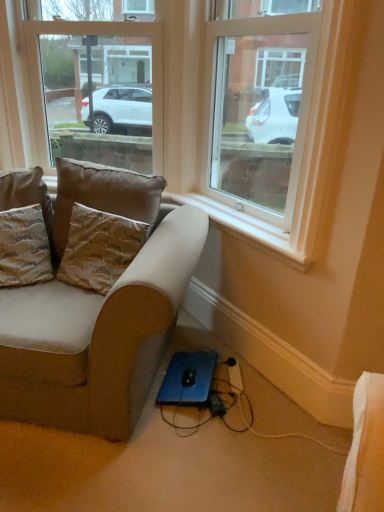
In order to face brown fabric pillow at upper left, positioned as the third pillow in left-to-right order, should I rotate leftwards or rightwards?

To face it directly, rotate left by 11.805 degrees.

Locate an element on the screen. The width and height of the screenshot is (384, 512). clear glass window at upper center, marked as the 1th window in a left-to-right arrangement is located at coordinates (97, 90).

The width and height of the screenshot is (384, 512). Identify the location of white smooth window sill at center. (246, 229).

I want to click on clear glass window at upper center, marked as the 2th window in a left-to-right arrangement, so click(259, 103).

This screenshot has width=384, height=512. Describe the element at coordinates (24, 247) in the screenshot. I see `textured brown pillow at left, the 3th pillow viewed from the right` at that location.

Where is `beige fabric couch at lower left`? beige fabric couch at lower left is located at coordinates (98, 313).

Could you tell me if beige fabric couch at lower left is facing textured brown pillow at left, the first pillow viewed from the left?

No, beige fabric couch at lower left is not aimed at textured brown pillow at left, the first pillow viewed from the left.

In terms of size, does beige fabric couch at lower left appear bigger or smaller than textured brown pillow at left, the first pillow viewed from the left?

Considering their sizes, beige fabric couch at lower left takes up more space than textured brown pillow at left, the first pillow viewed from the left.

From the picture: Between beige fabric couch at lower left and textured brown pillow at left, the first pillow viewed from the left, which one has smaller width?

textured brown pillow at left, the first pillow viewed from the left.

Considering the positions of objects beige fabric couch at lower left and textured brown pillow at left, placed as the 4th pillow when sorted from right to left, in the image provided, who is in front, beige fabric couch at lower left or textured brown pillow at left, placed as the 4th pillow when sorted from right to left,?

beige fabric couch at lower left.

Considering the relative sizes of textured brown pillow at left, which is counted as the 2th pillow, starting from the left, and textured brown pillow at left, the first pillow viewed from the left, in the image provided, is textured brown pillow at left, which is counted as the 2th pillow, starting from the left, wider than textured brown pillow at left, the first pillow viewed from the left,?

No.

Is textured brown pillow at left, which is counted as the 2th pillow, starting from the left, inside or outside of textured brown pillow at left, the first pillow viewed from the left?

textured brown pillow at left, which is counted as the 2th pillow, starting from the left, is contained in textured brown pillow at left, the first pillow viewed from the left.

Is point (21, 232) closer to camera compared to point (16, 170)?

That is True.

Who is taller, textured brown pillow at left, the 3th pillow viewed from the right, or textured brown pillow at left, placed as the 4th pillow when sorted from right to left?

With more height is textured brown pillow at left, placed as the 4th pillow when sorted from right to left.

Would you say textured brown pillow at left, the first pillow viewed from the left, is part of black plastic extension cord at lower center's contents?

No, textured brown pillow at left, the first pillow viewed from the left, is not a part of black plastic extension cord at lower center.

Is black plastic extension cord at lower center wider or thinner than textured brown pillow at left, the first pillow viewed from the left?

Clearly, black plastic extension cord at lower center has less width compared to textured brown pillow at left, the first pillow viewed from the left.

Is black plastic extension cord at lower center bigger or smaller than textured brown pillow at left, the first pillow viewed from the left?

black plastic extension cord at lower center is smaller than textured brown pillow at left, the first pillow viewed from the left.

This screenshot has width=384, height=512. What are the coordinates of `extension cord below the textured brown pillow at left, placed as the 4th pillow when sorted from right to left (from the image's perspective)` in the screenshot? It's located at (234, 376).

Considering the positions of points (300, 258) and (236, 385), is point (300, 258) closer to camera compared to point (236, 385)?

That is True.

Looking at this image, is white smooth window sill at center inside the boundaries of black plastic extension cord at lower center, or outside?

white smooth window sill at center is not inside black plastic extension cord at lower center, it's outside.

Which object is further away from the camera taking this photo, white smooth window sill at center or black plastic extension cord at lower center?

black plastic extension cord at lower center.

From a real-world perspective, which object rests below the other?

black plastic extension cord at lower center.

Is the position of textured brown pillow at left, the first pillow viewed from the left, less distant than that of clear glass window at upper center, marked as the 1th window in a left-to-right arrangement?

Yes, textured brown pillow at left, the first pillow viewed from the left, is closer to the camera.

Is clear glass window at upper center, which ranks as the second window in right-to-left order, located within textured brown pillow at left, placed as the 4th pillow when sorted from right to left?

No.

From the picture: Which is less distant, (47,218) or (121,26)?

Point (47,218) appears to be closer to the viewer than point (121,26).

Is textured brown pillow at left, the first pillow viewed from the left, thinner than clear glass window at upper center, marked as the 1th window in a left-to-right arrangement?

No, textured brown pillow at left, the first pillow viewed from the left, is not thinner than clear glass window at upper center, marked as the 1th window in a left-to-right arrangement.

From a real-world perspective, is textured brown pillow at left, which is counted as the 2th pillow, starting from the left, below brown textured pillow at left, which is counted as the fourth pillow, starting from the left?

Correct, in the physical world, textured brown pillow at left, which is counted as the 2th pillow, starting from the left, is lower than brown textured pillow at left, which is counted as the fourth pillow, starting from the left.

Does textured brown pillow at left, which is counted as the 2th pillow, starting from the left, have a greater width compared to brown textured pillow at left, the 1th pillow viewed from the right?

Indeed, textured brown pillow at left, which is counted as the 2th pillow, starting from the left, has a greater width compared to brown textured pillow at left, the 1th pillow viewed from the right.

Is point (6, 260) positioned behind point (82, 217)?

No, it is not.

From the image's perspective, is textured brown pillow at left, which is counted as the 2th pillow, starting from the left, positioned above or below brown textured pillow at left, the 1th pillow viewed from the right?

textured brown pillow at left, which is counted as the 2th pillow, starting from the left, is below brown textured pillow at left, the 1th pillow viewed from the right.

Is brown fabric pillow at upper left, positioned as the third pillow in left-to-right order, in contact with black plastic extension cord at lower center?

There is a gap between brown fabric pillow at upper left, positioned as the third pillow in left-to-right order, and black plastic extension cord at lower center.

From the image's perspective, which object appears higher, brown fabric pillow at upper left, positioned as the third pillow in left-to-right order, or black plastic extension cord at lower center?

brown fabric pillow at upper left, positioned as the third pillow in left-to-right order, appears higher in the image.

Is brown fabric pillow at upper left, positioned as the third pillow in left-to-right order, bigger or smaller than black plastic extension cord at lower center?

brown fabric pillow at upper left, positioned as the third pillow in left-to-right order, is bigger than black plastic extension cord at lower center.

Where is `studio couch in front of the textured brown pillow at left, the first pillow viewed from the left`? Image resolution: width=384 pixels, height=512 pixels. studio couch in front of the textured brown pillow at left, the first pillow viewed from the left is located at coordinates (98, 313).

This screenshot has height=512, width=384. What are the coordinates of `the 2nd pillow directly above the textured brown pillow at left, the 3th pillow viewed from the right (from a real-world perspective)` in the screenshot? It's located at (27, 195).

Based on their spatial positions, is brown fabric pillow at upper left, positioned as the third pillow in left-to-right order, or clear glass window at upper center, which ranks as the second window in right-to-left order, closer to beige fabric couch at lower left?

brown fabric pillow at upper left, positioned as the third pillow in left-to-right order.

From the image, which object appears to be nearer to textured brown pillow at left, which is counted as the 2th pillow, starting from the left, brown fabric pillow at upper left, the 2th pillow from the right, or brown textured pillow at left, the 1th pillow viewed from the right?

brown textured pillow at left, the 1th pillow viewed from the right, is closer to textured brown pillow at left, which is counted as the 2th pillow, starting from the left.

From the image, which object appears to be nearer to textured brown pillow at left, placed as the 4th pillow when sorted from right to left, clear glass window at upper center, marked as the 1th window in a left-to-right arrangement, or brown textured pillow at left, which is counted as the fourth pillow, starting from the left?

brown textured pillow at left, which is counted as the fourth pillow, starting from the left, is closer to textured brown pillow at left, placed as the 4th pillow when sorted from right to left.

Estimate the real-world distances between objects in this image. Which object is further from clear glass window at upper center, marked as the 1th window in a left-to-right arrangement, clear glass window at upper center, which is counted as the first window, starting from the right, or black plastic extension cord at lower center?

The object further to clear glass window at upper center, marked as the 1th window in a left-to-right arrangement, is black plastic extension cord at lower center.

Considering their positions, is beige fabric couch at lower left positioned closer to black plastic extension cord at lower center than brown textured pillow at left, the 1th pillow viewed from the right?

beige fabric couch at lower left.

Considering their positions, is white smooth window sill at center positioned closer to beige fabric couch at lower left than brown textured pillow at left, which is counted as the fourth pillow, starting from the left?

brown textured pillow at left, which is counted as the fourth pillow, starting from the left, lies closer to beige fabric couch at lower left than the other object.

Considering their positions, is brown textured pillow at left, the 1th pillow viewed from the right, positioned further to clear glass window at upper center, marked as the 2th window in a left-to-right arrangement, than textured brown pillow at left, the 3th pillow viewed from the right?

Among the two, textured brown pillow at left, the 3th pillow viewed from the right, is located further to clear glass window at upper center, marked as the 2th window in a left-to-right arrangement.

Based on their spatial positions, is white smooth window sill at center or black plastic extension cord at lower center closer to beige fabric couch at lower left?

white smooth window sill at center is closer to beige fabric couch at lower left.

Image resolution: width=384 pixels, height=512 pixels. I want to click on studio couch between textured brown pillow at left, the 3th pillow viewed from the right, and white smooth window sill at center, in the horizontal direction, so click(x=98, y=313).

Locate an element on the screen. pillow between clear glass window at upper center, marked as the 1th window in a left-to-right arrangement, and brown fabric pillow at upper left, the 2th pillow from the right, from top to bottom is located at coordinates (27, 195).

Locate an element on the screen. The width and height of the screenshot is (384, 512). studio couch between clear glass window at upper center, marked as the 1th window in a left-to-right arrangement, and black plastic extension cord at lower center in the up-down direction is located at coordinates tap(98, 313).

Where is `studio couch between textured brown pillow at left, the first pillow viewed from the left, and clear glass window at upper center, marked as the 2th window in a left-to-right arrangement, from left to right`? Image resolution: width=384 pixels, height=512 pixels. studio couch between textured brown pillow at left, the first pillow viewed from the left, and clear glass window at upper center, marked as the 2th window in a left-to-right arrangement, from left to right is located at coordinates (98, 313).